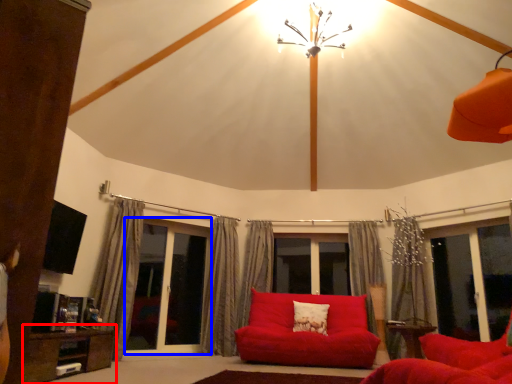
Question: Which object is further to the camera taking this photo, table (highlighted by a red box) or screen door (highlighted by a blue box)?

Choices:
 (A) table
 (B) screen door

Answer: (B)